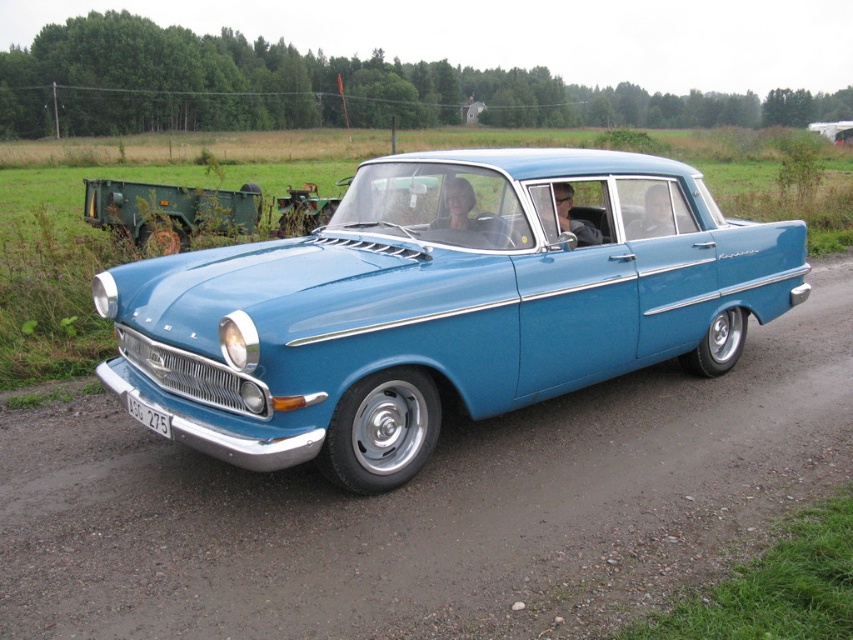
You are a photographer standing on the side of the road. You want to take a photo of the matte blue car at center so that the dirttrack at center is visible in the background. Which direction should you position yourself relative to the car?

You should position yourself to the right of the matte blue car at center so that the dirttrack at center, which is to the left of the car, becomes visible in the background.

You are a photographer taking a picture of the matte blue car at center and the white plastic license plate at lower center. Which object is positioned higher in the image?

The matte blue car at center is positioned higher than the white plastic license plate at lower center.